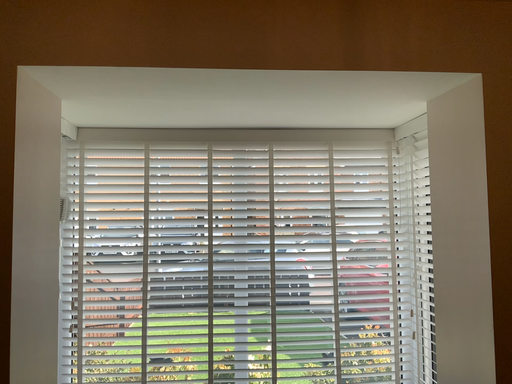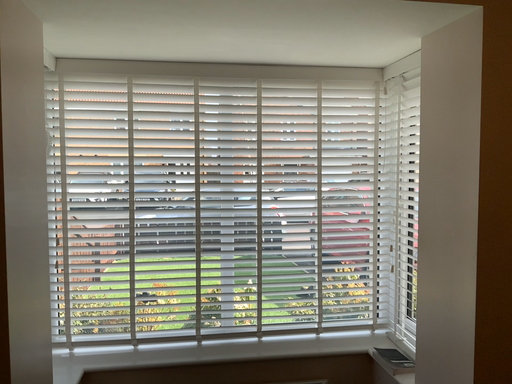
Question: How did the camera likely rotate when shooting the video?

Choices:
 (A) rotated upward
 (B) rotated downward

Answer: (B)